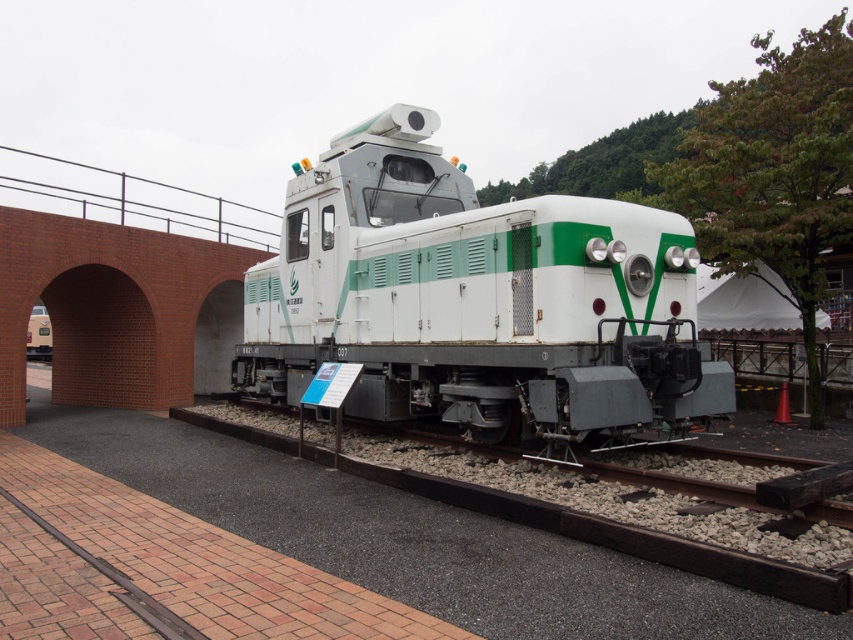
Is white/green painted locomotive at center taller than brick at left?

In fact, white/green painted locomotive at center may be shorter than brick at left.

Is point (488, 244) positioned behind point (251, 257)?

No, it is not.

The image size is (853, 640). I want to click on white/green painted locomotive at center, so click(474, 298).